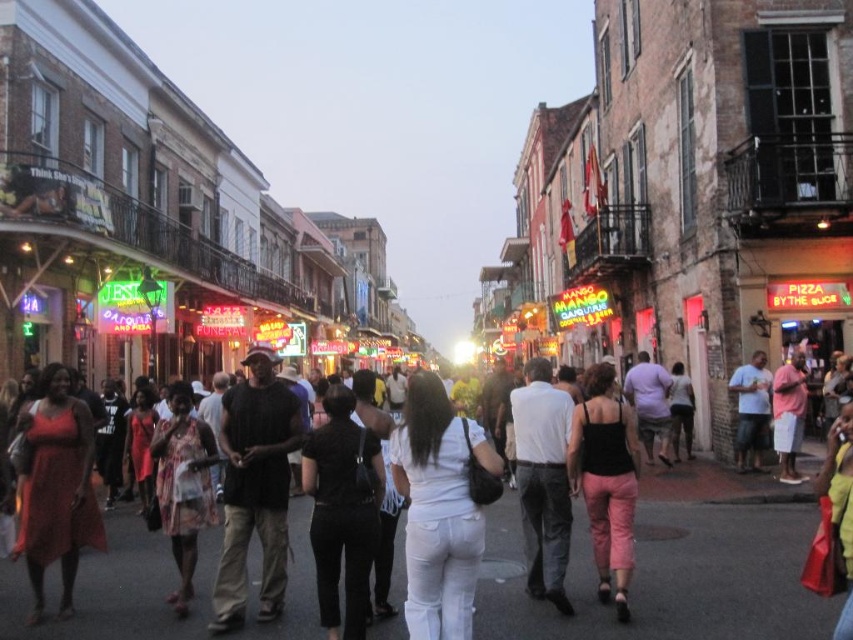
Question: Can you confirm if white cotton shirt at center is bigger than matte black tank top at center?

Choices:
 (A) no
 (B) yes

Answer: (B)

Question: Among these objects, which one is nearest to the camera?

Choices:
 (A) matte red dress at lower left
 (B) matte black shirt at center

Answer: (A)

Question: Which of these objects is positioned farthest from the white matte pants at center?

Choices:
 (A) matte red dress at lower left
 (B) matte black shirt at center

Answer: (B)

Question: Can you confirm if matte black tank top at center is positioned above matte black shirt at center?

Choices:
 (A) yes
 (B) no

Answer: (B)

Question: Is white cotton shirt at center to the right of neon/glass sign at center from the viewer's perspective?

Choices:
 (A) no
 (B) yes

Answer: (A)

Question: Which of the following is the closest to the observer?

Choices:
 (A) (753, 390)
 (B) (630, 438)

Answer: (B)